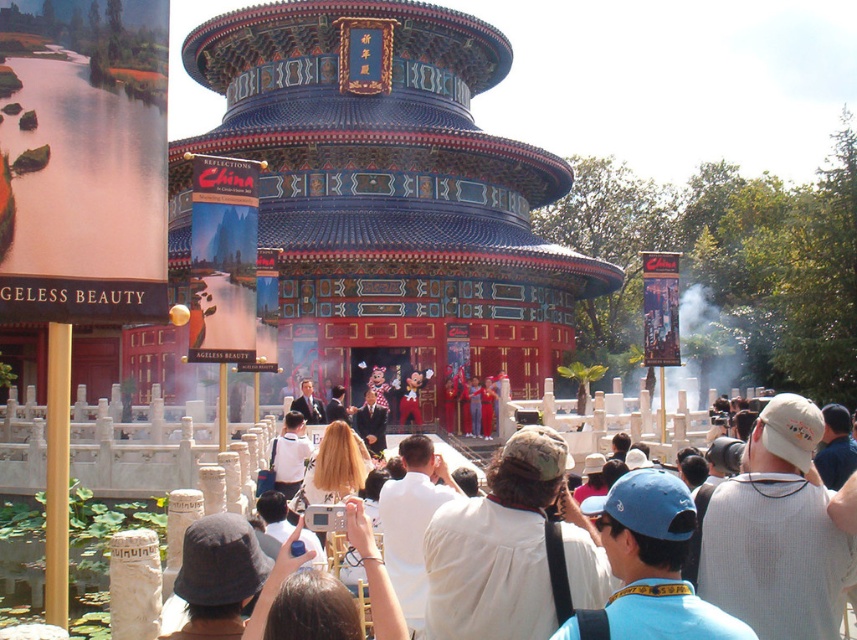
Question: Can you confirm if white cotton crowd at center is smaller than white knit cap at center?

Choices:
 (A) yes
 (B) no

Answer: (B)

Question: Based on their relative distances, which object is nearer to the white knit cap at center?

Choices:
 (A) white plastic camera at center
 (B) blue fabric cap at center
 (C) white cotton shirt at center
 (D) white cotton crowd at center

Answer: (D)

Question: Is white knit cap at center below white plastic camera at center?

Choices:
 (A) no
 (B) yes

Answer: (A)

Question: Which point is closer to the camera?

Choices:
 (A) (289, 556)
 (B) (460, 602)
 (C) (832, 620)
 (D) (562, 627)

Answer: (D)

Question: Among these objects, which one is farthest from the camera?

Choices:
 (A) white cotton shirt at center
 (B) white knit cap at center
 (C) white cotton crowd at center
 (D) white plastic camera at center

Answer: (B)

Question: Is white knit cap at center below white plastic camera at center?

Choices:
 (A) no
 (B) yes

Answer: (A)